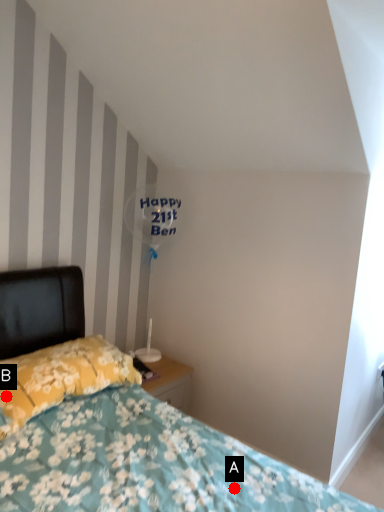
Question: Two points are circled on the image, labeled by A and B beside each circle. Among these points, which one is nearest to the camera?

Choices:
 (A) A is closer
 (B) B is closer

Answer: (A)